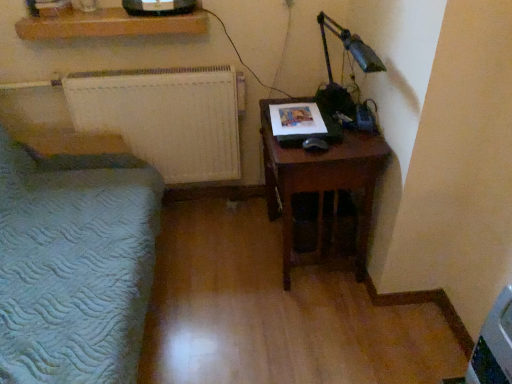
Identify the location of free location to the left of brown wooden nightstand at right. (220, 256).